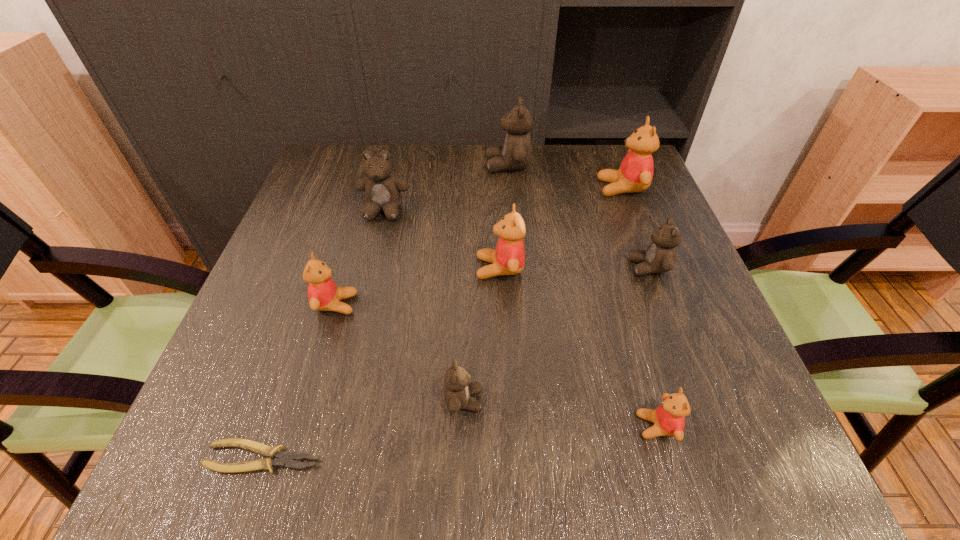
Image resolution: width=960 pixels, height=540 pixels. Identify the location of the farthest brown teddy bear. (515, 154).

The width and height of the screenshot is (960, 540). In order to click on the third brown teddy bear from left to right in this screenshot , I will do `click(515, 154)`.

At what (x,y) coordinates should I click in order to perform the action: click on the biggest red teddy bear. Please return your answer as a coordinate pair (x, y). This screenshot has width=960, height=540. Looking at the image, I should click on (635, 174).

Identify the location of the second biggest brown teddy bear. (382, 189).

You are a GUI agent. You are given a task and a screenshot of the screen. Output one action in this format:
    pyautogui.click(x=<x>, y=<y>)
    Task: Click on the third nearest brown teddy bear
    
    Given the screenshot: What is the action you would take?
    pyautogui.click(x=382, y=189)

The width and height of the screenshot is (960, 540). In order to click on the second biggest red teddy bear in this screenshot , I will do [508, 258].

Where is `the leftmost red teddy bear`? the leftmost red teddy bear is located at coordinates (323, 294).

Locate an element on the screen. The height and width of the screenshot is (540, 960). the second nearest brown teddy bear is located at coordinates (660, 256).

I want to click on the rightmost brown teddy bear, so click(x=660, y=256).

The image size is (960, 540). I want to click on the nearest brown teddy bear, so click(458, 387).